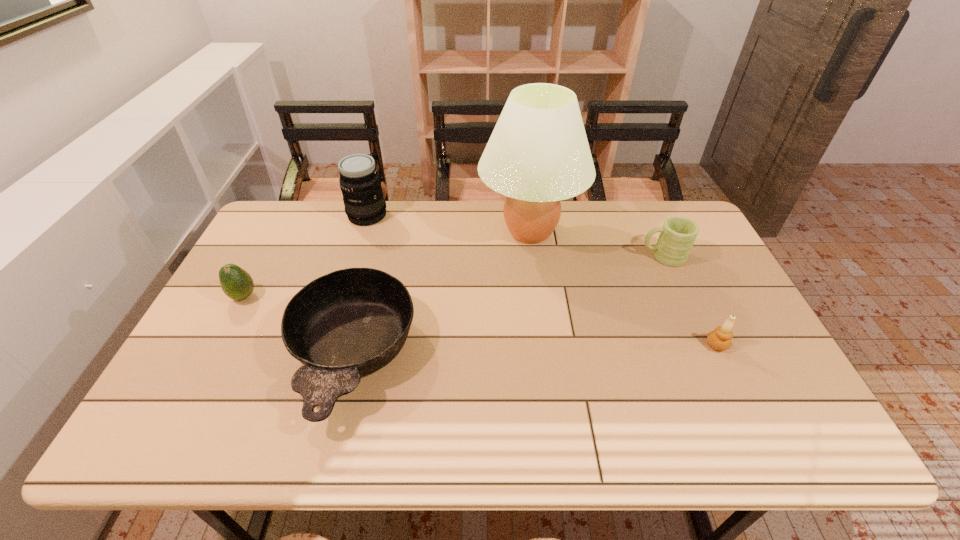
This screenshot has height=540, width=960. In order to click on the tallest object in this screenshot , I will do `click(538, 154)`.

Where is `lampshade`? lampshade is located at coordinates (538, 154).

You are a GUI agent. You are given a task and a screenshot of the screen. Output one action in this format:
    pyautogui.click(x=<x>, y=<y>)
    Task: Click on the telephoto lens
    The height and width of the screenshot is (540, 960).
    Given the screenshot: What is the action you would take?
    tap(360, 183)

The image size is (960, 540). Identify the location of mug. (678, 234).

Where is `avocado`? The width and height of the screenshot is (960, 540). avocado is located at coordinates pos(236,283).

Where is `candle_holder`? candle_holder is located at coordinates (720, 339).

What are the coordinates of `frying pan` in the screenshot? It's located at (350, 323).

Locate an element on the screen. The height and width of the screenshot is (540, 960). free spot located 0.170m on the shade of the third object from right to left is located at coordinates (427, 232).

I want to click on free space located 0.360m on the shade of the third object from right to left, so click(x=372, y=232).

Where is `vacant area situated on the shade of the third object from right to left`? vacant area situated on the shade of the third object from right to left is located at coordinates (460, 232).